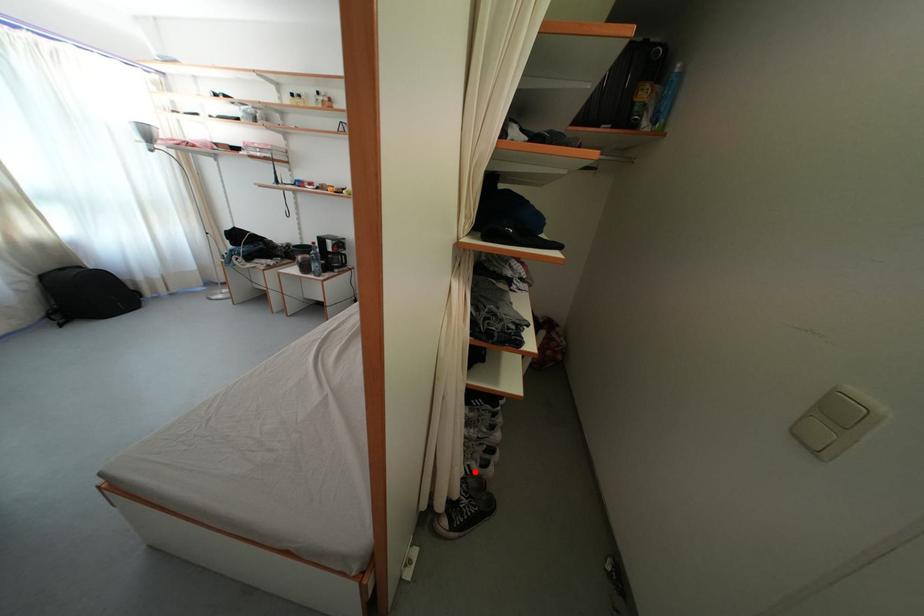
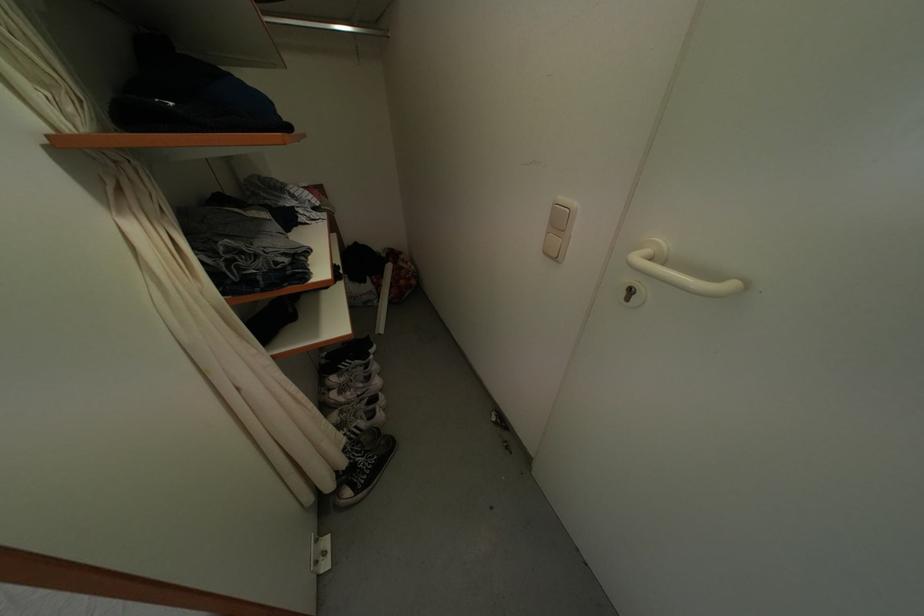
Question: I am providing you with two images of the same scene from different viewpoints. In image1, a red point is highlighted. Considering the same 3D point in image2, which of the following is correct?

Choices:
 (A) It is closer
 (B) It is farther

Answer: (B)